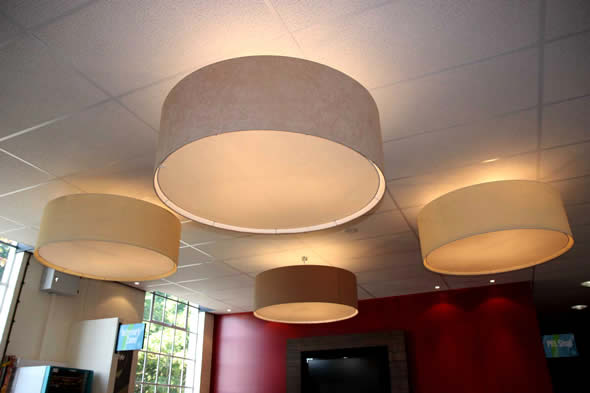
Locate an element on the screen. accent lighting is located at coordinates (583, 309).